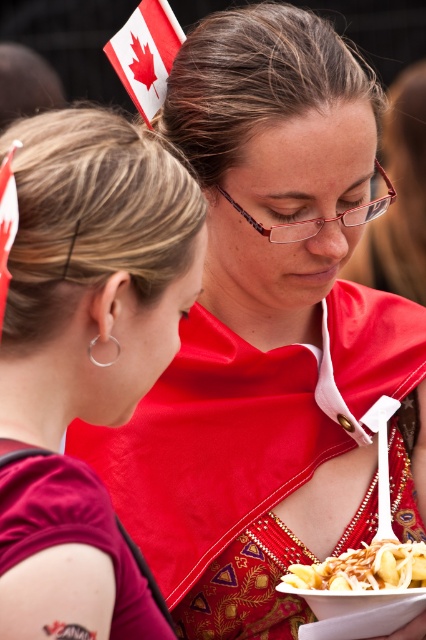
You are a photographer standing at the event. You want to take a closeup shot of the red fabric flag at upper left without including the people in the frame. Given that the camera is 7.12 feet away from the flag, can you estimate whether the camera is positioned far enough to capture the flag clearly while excluding the people?

The camera is 7.12 feet away from the red fabric flag at upper left. Since the flag is at the upper left and the people are in the foreground, this distance should allow the photographer to focus on the flag while blurring or excluding the people in the background. However, exact framing depends on lens choice and aperture settings.

You are standing at the event and want to take a photo of the red fabric canadian flag at upper left. If your camera can focus on objects up to 1.5 meters away, will it be able to capture the flag clearly?

The red fabric canadian flag at upper left is 1.40 meters away from the viewer, which is within the camera focus range of up to 1.5 meters. Therefore, the camera can capture the flag clearly.

You are at the coordinates 0.5, 0.2. There is a matte red dress at center. Can you reach it without moving your position?

The matte red dress at center is located at point (85, 358), which is very close to your current position at (85, 320). You can easily reach it without moving.